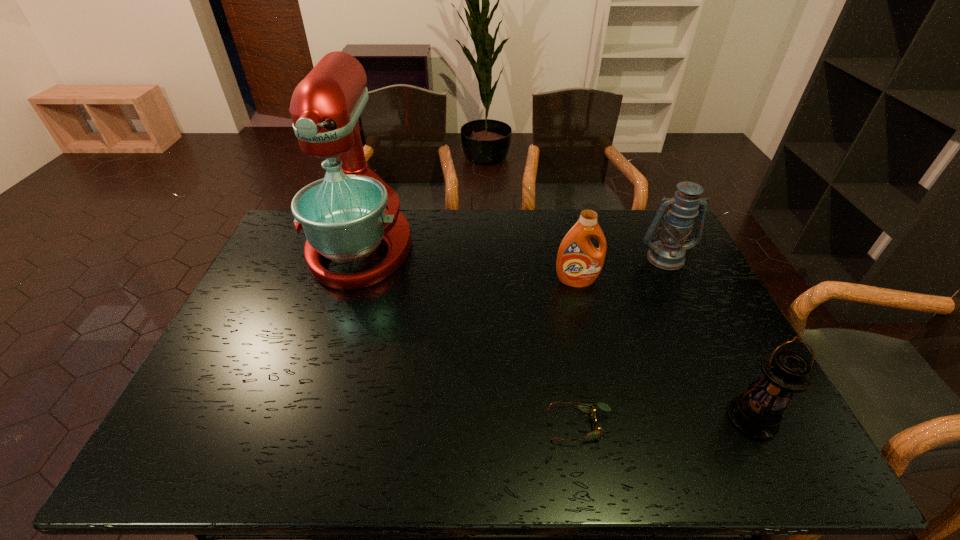
I want to click on free space located 0.240m on the front-facing side of the shortest object, so click(x=446, y=426).

Locate an element on the screen. The width and height of the screenshot is (960, 540). vacant space located 0.340m on the front-facing side of the shortest object is located at coordinates (404, 426).

Find the location of a particular element. The height and width of the screenshot is (540, 960). mixer located in the far edge section of the desktop is located at coordinates (345, 216).

You are a GUI agent. You are given a task and a screenshot of the screen. Output one action in this format:
    pyautogui.click(x=<x>, y=<y>)
    Task: Click on the lantern present at the far edge
    The image size is (960, 540).
    Given the screenshot: What is the action you would take?
    pyautogui.click(x=668, y=253)

The height and width of the screenshot is (540, 960). Identify the location of lantern that is at the near edge. (757, 413).

Where is `spectacles located in the near edge section of the desktop`? The image size is (960, 540). spectacles located in the near edge section of the desktop is located at coordinates (588, 408).

The width and height of the screenshot is (960, 540). I want to click on object that is positioned at the left edge, so click(x=345, y=216).

Find the location of a particular element. object located in the far left corner section of the desktop is located at coordinates (345, 216).

You are a GUI agent. You are given a task and a screenshot of the screen. Output one action in this format:
    pyautogui.click(x=<x>, y=<y>)
    Task: Click on the object present at the far right corner
    
    Given the screenshot: What is the action you would take?
    pos(668,253)

What are the coordinates of `object that is at the near right corner` in the screenshot? It's located at (757, 413).